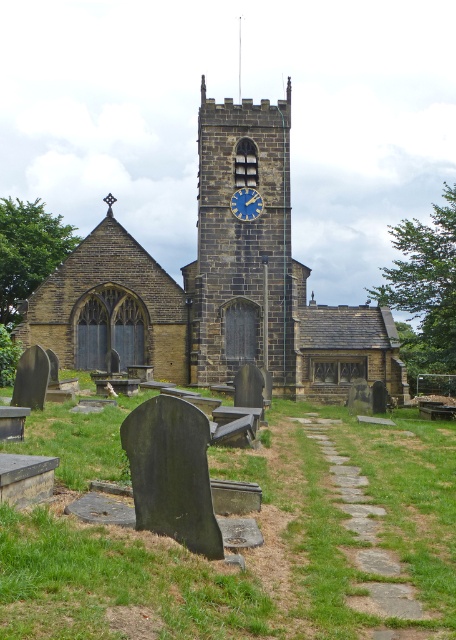
You are standing in front of the brown stone church at center and want to look at the blue painted clock face at center. Which direction should you move to see the clock face better?

The brown stone church at center is positioned under the blue painted clock face at center, so you should look upward to see the clock face better.

You are an architect visiting the brown stone church at center and the stone clock tower at center. You need to determine which structure requires more materials to construct. Based on the scene, which one would you say needs more materials?

The brown stone church at center is bigger than the stone clock tower at center, so it would require more materials to construct.

You are standing in front of the brown stone church at center and the blue painted clock face at center. Which one is positioned to the right?

The blue painted clock face at center is positioned to the right of the brown stone church at center.